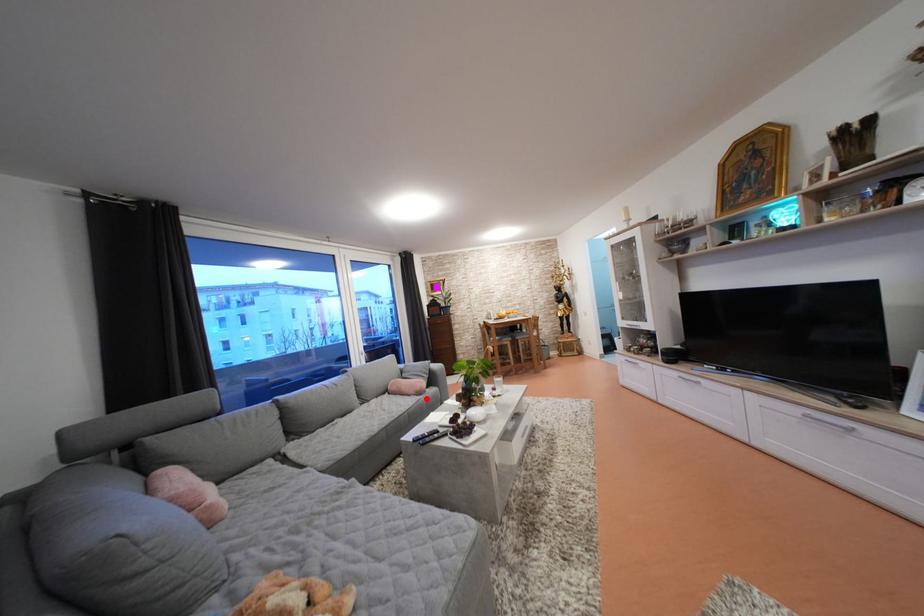
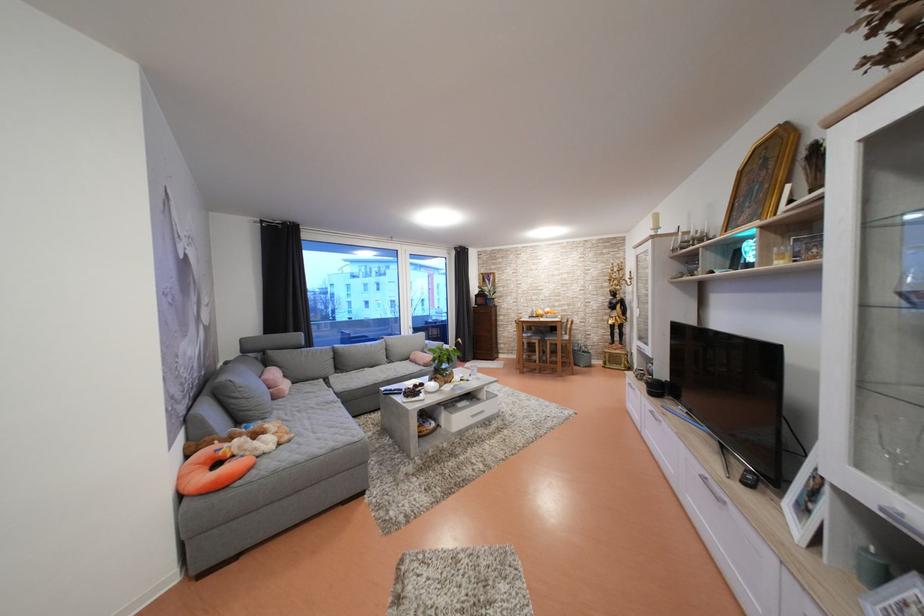
Find the pixel in the second image that matches the highlighted location in the first image.

(432, 370)